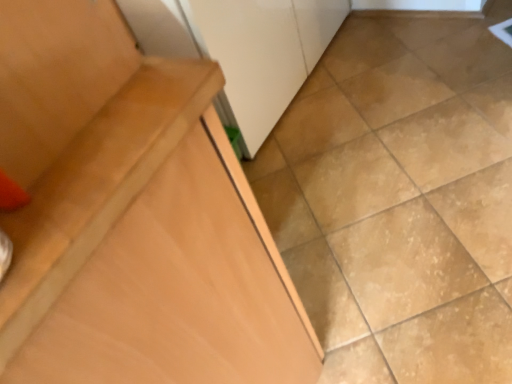
What do you see at coordinates (131, 217) in the screenshot? I see `matte wood cabinet at lower left` at bounding box center [131, 217].

What is the approximate width of matte wood cabinet at lower left?

The width of matte wood cabinet at lower left is 3.74 feet.

Identify the location of matte wood cabinet at lower left. The image size is (512, 384). (131, 217).

At what (x,y) coordinates should I click in order to perform the action: click on matte wood cabinet at lower left. Please return your answer as a coordinate pair (x, y). This screenshot has height=384, width=512. Looking at the image, I should click on (131, 217).